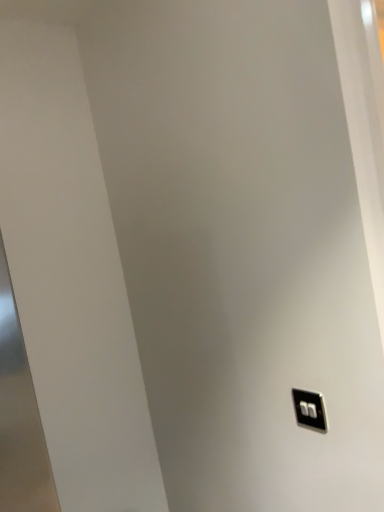
The width and height of the screenshot is (384, 512). In order to click on black plastic power plugs and sockets at lower right in this screenshot , I will do `click(310, 409)`.

What do you see at coordinates (310, 409) in the screenshot?
I see `black plastic power plugs and sockets at lower right` at bounding box center [310, 409].

The width and height of the screenshot is (384, 512). Identify the location of black plastic power plugs and sockets at lower right. (310, 409).